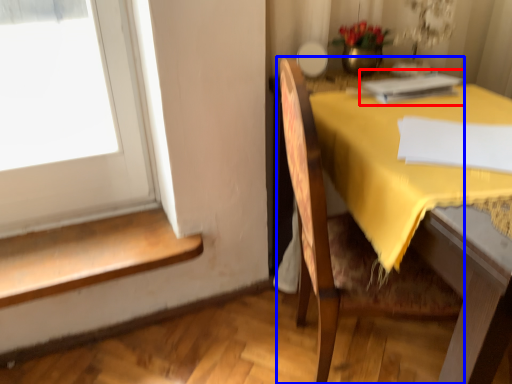
Question: Among these objects, which one is nearest to the camera, book (highlighted by a red box) or chair (highlighted by a blue box)?

Choices:
 (A) book
 (B) chair

Answer: (B)